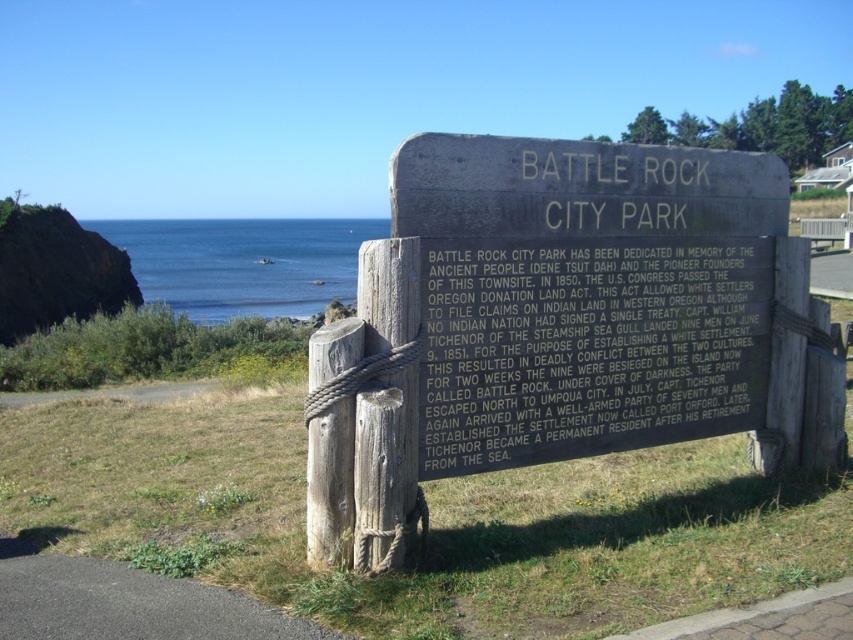
Question: Is blue water at center further to the viewer compared to rope-tied wood post at center?

Choices:
 (A) yes
 (B) no

Answer: (A)

Question: Can you confirm if black polished stone plaque at center is positioned above blue water at center?

Choices:
 (A) yes
 (B) no

Answer: (B)

Question: Which point is closer to the camera taking this photo?

Choices:
 (A) (169, 294)
 (B) (395, 262)
 (C) (564, 369)

Answer: (B)

Question: Which point is closer to the camera taking this photo?

Choices:
 (A) (368, 317)
 (B) (231, 250)

Answer: (A)

Question: Which of the following is the farthest from the observer?

Choices:
 (A) black polished stone plaque at center
 (B) rope-tied wood post at center
 (C) blue water at center

Answer: (C)

Question: Is black polished stone plaque at center to the left of blue water at center from the viewer's perspective?

Choices:
 (A) no
 (B) yes

Answer: (A)